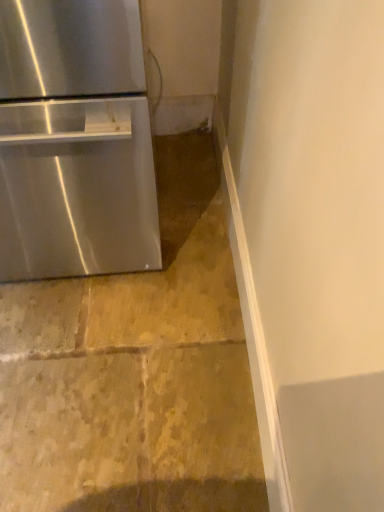
The image size is (384, 512). I want to click on stainless steel refrigerator at left, so click(135, 371).

What do you see at coordinates (135, 371) in the screenshot?
I see `stainless steel refrigerator at left` at bounding box center [135, 371].

Find the location of a particular element. The width and height of the screenshot is (384, 512). stainless steel refrigerator at left is located at coordinates (135, 371).